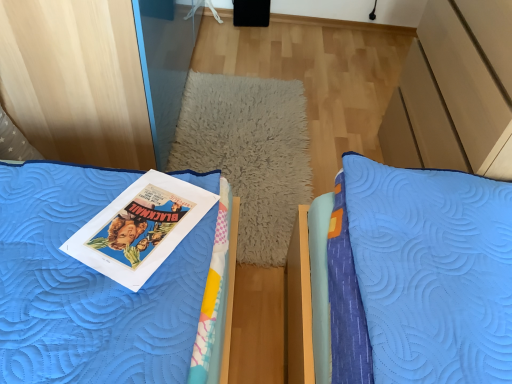
Question: From a real-world perspective, relative to matte paper book at center, is white fluffy pillow at center vertically above or below?

Choices:
 (A) above
 (B) below

Answer: (B)

Question: Is white fluffy pillow at center wider or thinner than matte paper book at center?

Choices:
 (A) wide
 (B) thin

Answer: (A)

Question: Relative to matte paper book at center, is white fluffy pillow at center in front or behind?

Choices:
 (A) behind
 (B) front

Answer: (A)

Question: Looking at their shapes, would you say matte paper book at center is wider or thinner than white fluffy pillow at center?

Choices:
 (A) thin
 (B) wide

Answer: (A)

Question: From the image's perspective, is matte paper book at center positioned above or below white fluffy pillow at center?

Choices:
 (A) above
 (B) below

Answer: (B)

Question: Is matte paper book at center to the left or to the right of white fluffy pillow at center in the image?

Choices:
 (A) left
 (B) right

Answer: (A)

Question: Is matte paper book at center inside or outside of white fluffy pillow at center?

Choices:
 (A) inside
 (B) outside

Answer: (B)